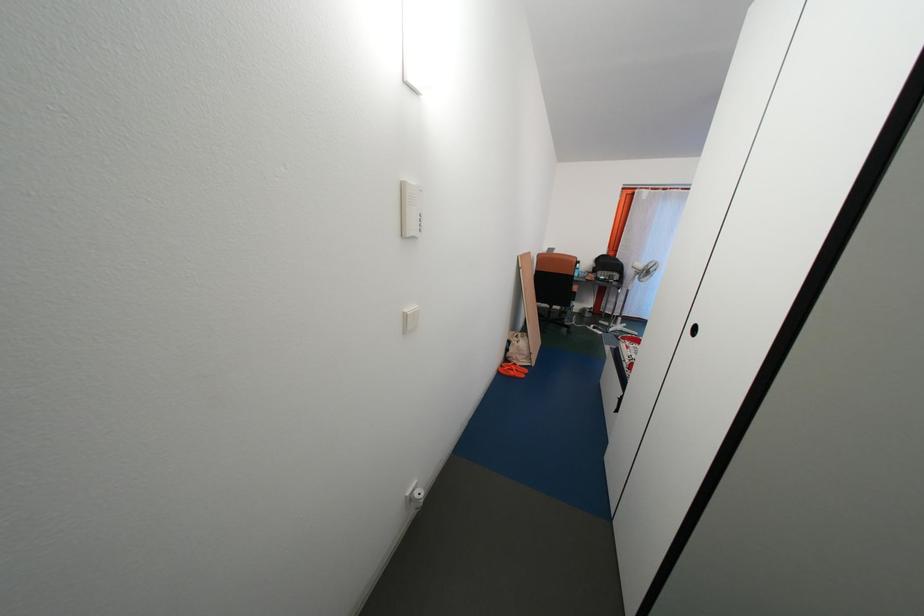
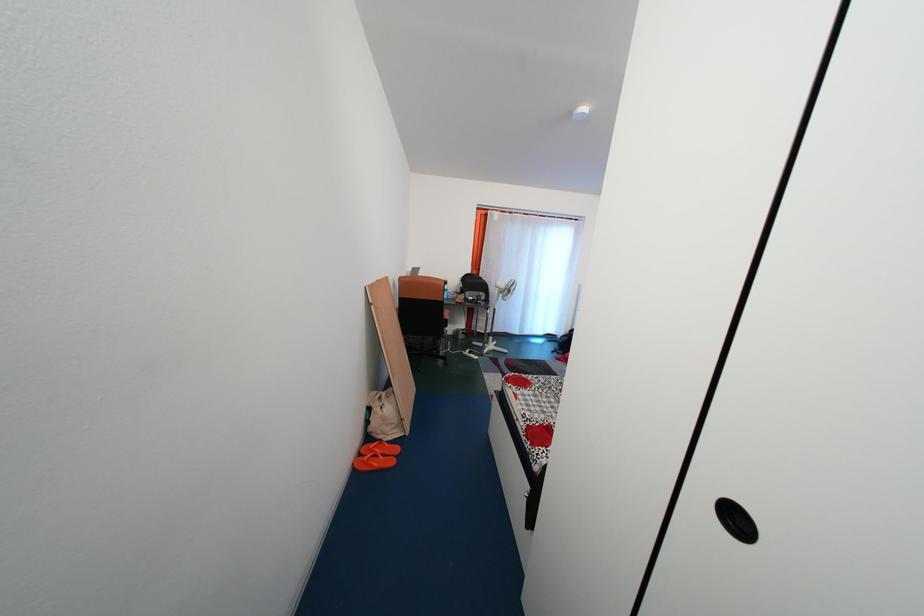
What movement of the cameraman would produce the second image?

The cameraman walked toward right, forward.